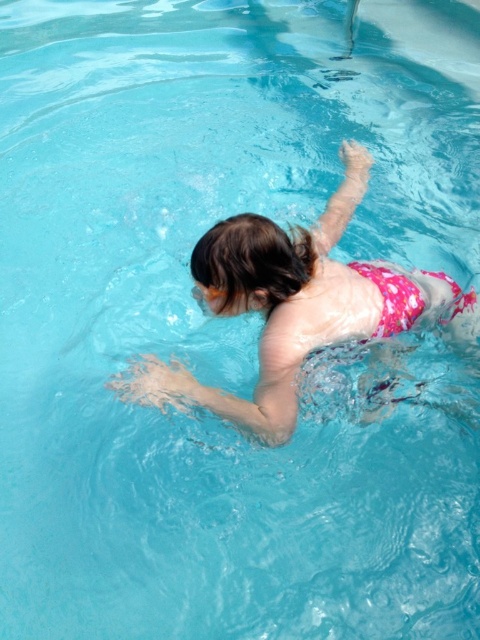
You are a GUI agent. You are given a task and a screenshot of the screen. Output one action in this format:
    pyautogui.click(x=<x>, y=<y>)
    Task: Click on the pink floral swimsuit at center
    The width and height of the screenshot is (480, 640).
    Given the screenshot: What is the action you would take?
    pyautogui.click(x=296, y=307)

Who is shorter, pink floral swimsuit at center or transparent plastic goggles at upper center?

transparent plastic goggles at upper center

Between point (260, 243) and point (215, 288), which one is positioned in front?

Positioned in front is point (260, 243).

This screenshot has height=640, width=480. Find the location of `pink floral swimsuit at center`. pink floral swimsuit at center is located at coordinates (296, 307).